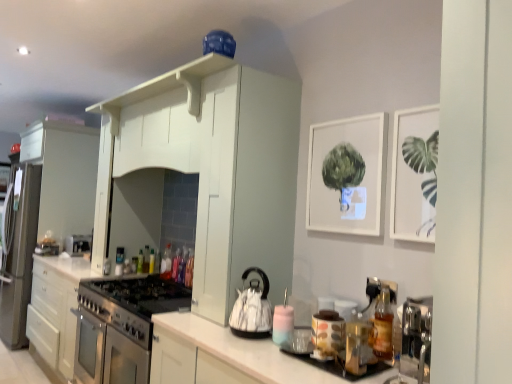
Question: From the image's perspective, is matte ceramic jar at center, positioned as the 1th appliance in right-to-left order, above or below translucent plastic bottle at center, which is the fifth bottle from right to left?

Choices:
 (A) above
 (B) below

Answer: (B)

Question: Is matte ceramic jar at center, positioned as the 1th appliance in right-to-left order, inside or outside of translucent plastic bottle at center, which appears as the 5th bottle when viewed from the back?

Choices:
 (A) inside
 (B) outside

Answer: (B)

Question: Which of these objects is positioned closest to the satin white cabinet at center, the 1th cabinetry from the back?

Choices:
 (A) translucent plastic bottle at center, which appears as the 5th bottle when viewed from the back
 (B) white matte picture frame at upper right, which ranks as the 1th picture frame in front-to-back order
 (C) translucent plastic bottle at center, marked as the seventh bottle in a left-to-right arrangement
 (D) white matte picture frame at upper center, the second picture frame in the right-to-left sequence
 (E) matte ceramic jar at center, positioned as the 1th appliance in right-to-left order

Answer: (A)

Question: Which object is positioned closest to the translucent plastic bottle at center, the third bottle from the right?

Choices:
 (A) translucent plastic bottle at center, the 3th bottle in the left-to-right sequence
 (B) translucent plastic bottle at center, arranged as the fourth bottle when viewed from the right
 (C) translucent plastic bottle at center, arranged as the 9th bottle when viewed from the right
 (D) white matte picture frame at upper center, the 1th picture frame viewed from the left
 (E) matte ceramic jar at center, positioned as the 1th appliance in right-to-left order

Answer: (B)